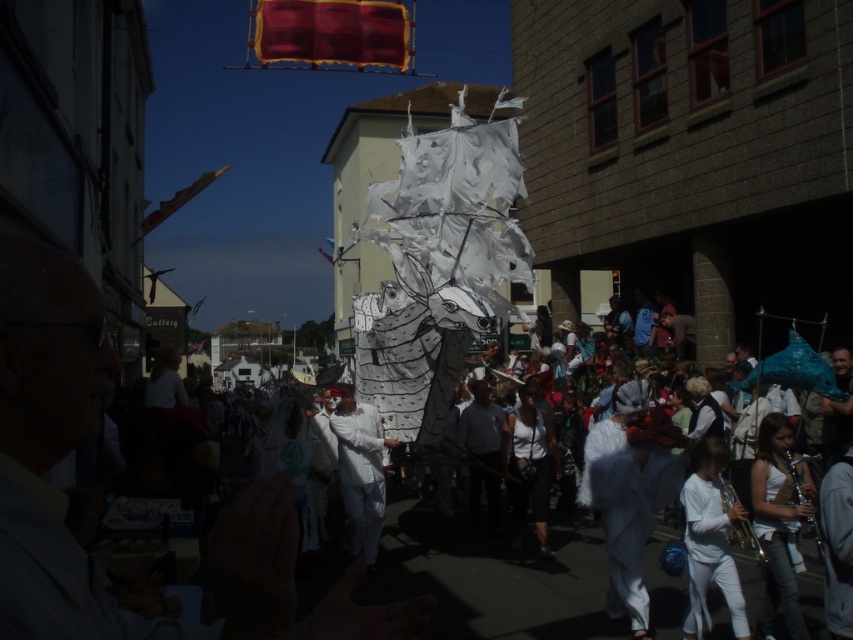
Question: Can you confirm if white paper dragon at center is wider than white paper ship at center?

Choices:
 (A) yes
 (B) no

Answer: (A)

Question: Does white paper mask at center have a greater width compared to white paper dragon at center?

Choices:
 (A) no
 (B) yes

Answer: (B)

Question: Which of these objects is positioned farthest from the white paper mask at center?

Choices:
 (A) white paper ship at center
 (B) white paper dragon at center

Answer: (A)

Question: Does white paper mask at center come behind white paper ship at center?

Choices:
 (A) yes
 (B) no

Answer: (B)

Question: Which is farther from the white paper ship at center?

Choices:
 (A) white paper dragon at center
 (B) white paper mask at center

Answer: (B)

Question: Which of the following is the closest to the observer?

Choices:
 (A) (389, 438)
 (B) (67, 557)

Answer: (B)